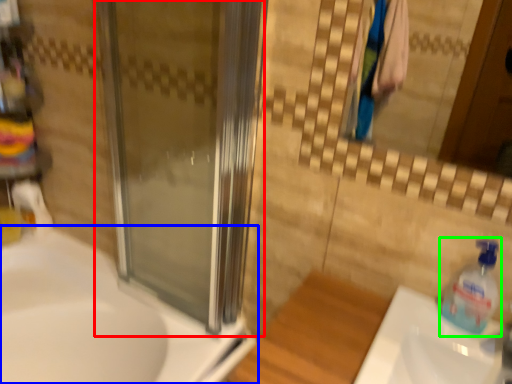
Question: Which is nearer to the screen door (highlighted by a red box)? sink (highlighted by a blue box) or cleaning product (highlighted by a green box).

Choices:
 (A) sink
 (B) cleaning product

Answer: (A)